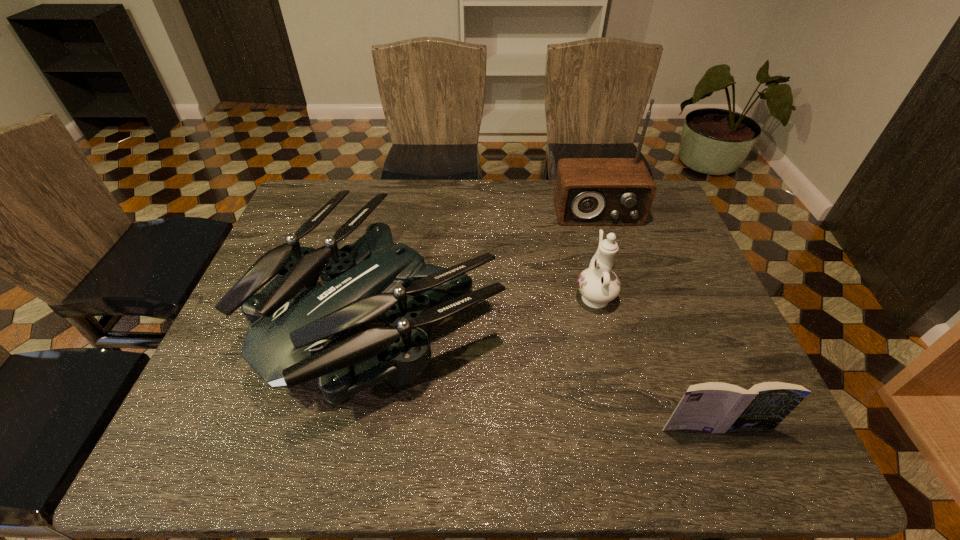
You are a GUI agent. You are given a task and a screenshot of the screen. Output one action in this format:
    pyautogui.click(x=<x>, y=<y>)
    Task: Click on the vacant space that is in between the leftmost object and the book
    The image size is (960, 540).
    Given the screenshot: What is the action you would take?
    pyautogui.click(x=549, y=373)

Locate an element on the screen. free area in between the shortest object and the chinaware is located at coordinates (655, 361).

Locate an element on the screen. This screenshot has height=540, width=960. the third closest object to the book is located at coordinates point(588,191).

You are a GUI agent. You are given a task and a screenshot of the screen. Output one action in this format:
    pyautogui.click(x=<x>, y=<y>)
    Task: Click on the object that is the second closest to the radio receiver
    The width and height of the screenshot is (960, 540).
    Given the screenshot: What is the action you would take?
    pyautogui.click(x=598, y=285)